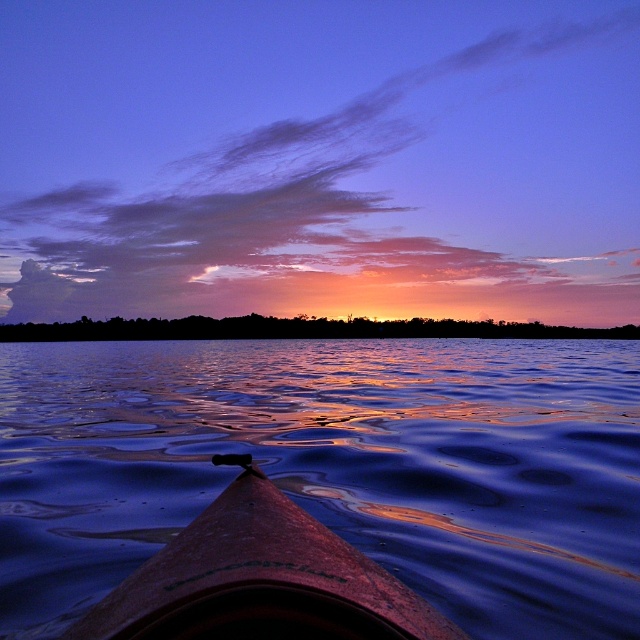
Who is higher up, glossy water at center or silhouetted trees at center?

Positioned higher is silhouetted trees at center.

Between point (104, 432) and point (371, 321), which one is positioned in front?

Point (104, 432)

Locate an element on the screen. glossy water at center is located at coordinates (333, 467).

Is glossy water at center below smooth brown canoe at center?

Correct, glossy water at center is located below smooth brown canoe at center.

Can you confirm if glossy water at center is thinner than smooth brown canoe at center?

In fact, glossy water at center might be wider than smooth brown canoe at center.

Does point (198, 497) come closer to viewer compared to point (163, 632)?

No, (198, 497) is further to viewer.

Identify the location of glossy water at center. This screenshot has width=640, height=640. (333, 467).

In the scene shown: Does smooth brown canoe at center appear on the left side of silhouetted trees at center?

Indeed, smooth brown canoe at center is positioned on the left side of silhouetted trees at center.

Based on the photo, does smooth brown canoe at center have a lesser height compared to silhouetted trees at center?

Yes, smooth brown canoe at center is shorter than silhouetted trees at center.

The height and width of the screenshot is (640, 640). Identify the location of smooth brown canoe at center. (260, 580).